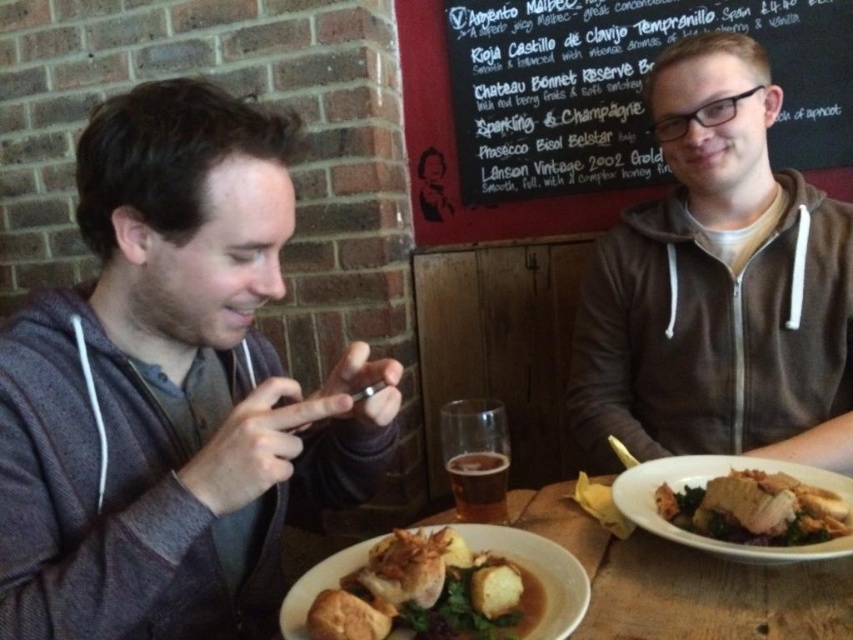
You are a delivery person standing 30 inches away from the table. You need to place a small package at point (457, 614). Can you reach it without moving closer?

The distance of point (457, 614) from viewer is 25.82 inches, so since you are 30 inches away from the table, you are too far to reach the point and need to move closer.

You are a photographer trying to capture the brown zip up hoodie at right. The camera you are using has a focus point at point (x=718, y=285). Will the focus point hit the brown zip up hoodie at right?

Yes, the brown zip up hoodie at right is located at point (x=718, y=285), so the focus point will hit it.

You are a server at the restaurant and need to place a new dish on the table between the white ceramic plate at center and the golden brown crusty bread at center. Which object should you move to make space?

The white ceramic plate at center is wider than the golden brown crusty bread at center, so you should move the white ceramic plate at center to make space for the new dish.